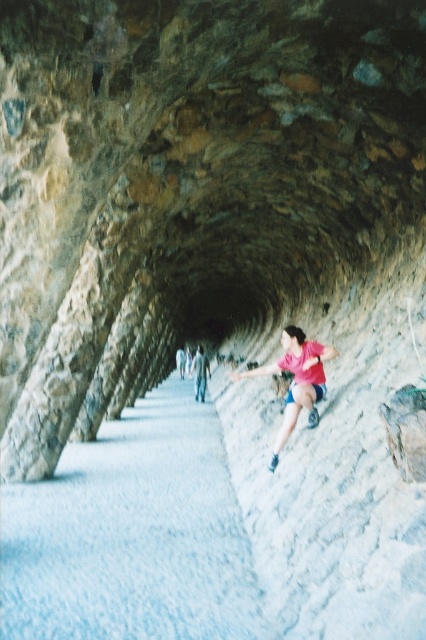
Question: Considering the relative positions of pink fabric shorts at center and pink fabric at center in the image provided, where is pink fabric shorts at center located with respect to pink fabric at center?

Choices:
 (A) below
 (B) above

Answer: (B)

Question: Does pink fabric shorts at center appear under pink fabric at center?

Choices:
 (A) no
 (B) yes

Answer: (A)

Question: Is pink fabric shorts at center smaller than pink fabric at center?

Choices:
 (A) no
 (B) yes

Answer: (B)

Question: Among these objects, which one is farthest from the camera?

Choices:
 (A) pink fabric shorts at center
 (B) pink fabric at center

Answer: (B)